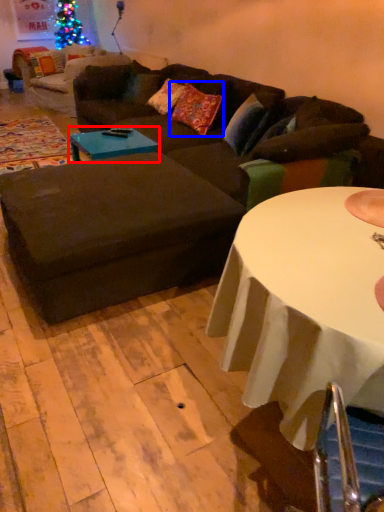
Question: Which point is closer to the camera, coffee table (highlighted by a red box) or pillow (highlighted by a blue box)?

Choices:
 (A) coffee table
 (B) pillow

Answer: (A)